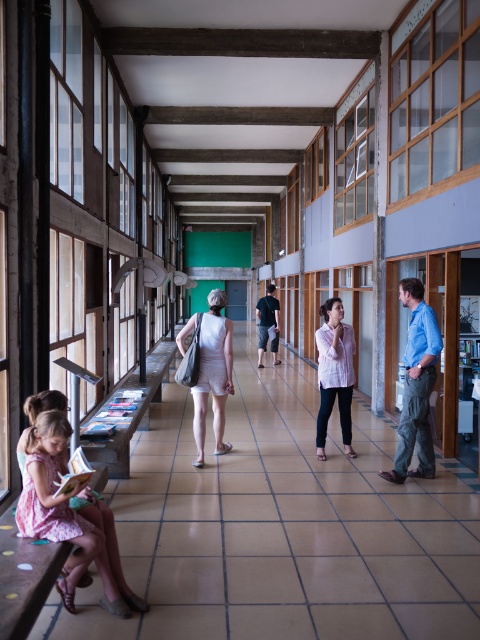
Question: Is blue cotton shirt at right positioned in front of dark gray cotton t-shirt at center?

Choices:
 (A) no
 (B) yes

Answer: (B)

Question: Which point is farther to the camera?

Choices:
 (A) pink fabric dress at lower left
 (B) blue cotton shirt at right

Answer: (B)

Question: Which object is farther from the camera taking this photo?

Choices:
 (A) white striped shirt at center
 (B) white cotton dress at center

Answer: (A)

Question: Which point is closer to the camera taking this photo?

Choices:
 (A) (202, 346)
 (B) (273, 298)

Answer: (A)

Question: Observing the image, what is the correct spatial positioning of pink fabric dress at lower left in reference to white striped shirt at center?

Choices:
 (A) left
 (B) right

Answer: (A)

Question: Does white cotton dress at center appear under white striped shirt at center?

Choices:
 (A) yes
 (B) no

Answer: (B)